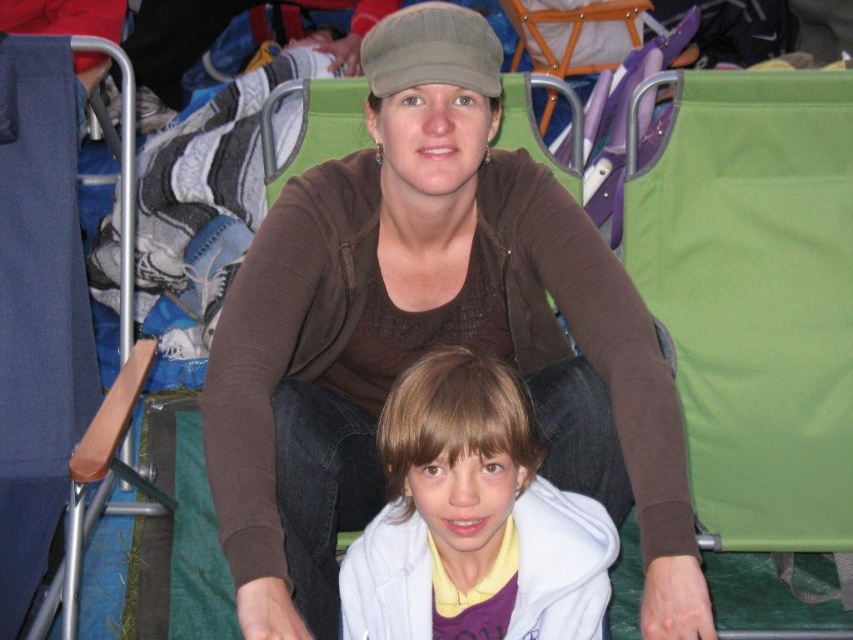
You are trying to decide which clothing item to take with you from the scene. Both the brown fabric sweater at center and the white fleece jacket at center are available. Which one is physically closer to you as you look at the image?

The brown fabric sweater at center is closer to the viewer than the white fleece jacket at center, so you should take the brown fabric sweater at center since it is nearer to you in the image.

You are trying to decide which clothing item to take with you on a chilly day. You see the brown fabric sweater at center and the white fleece jacket at center in the image. Which one would you choose if you want something that covers more of your body?

The brown fabric sweater at center has a larger size compared to the white fleece jacket at center, so it would cover more of your body and be a better choice for a chilly day.